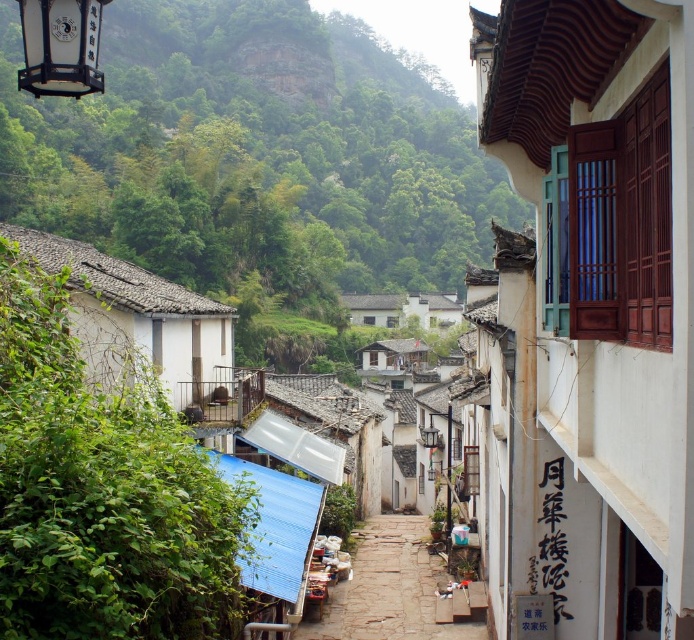
You are a tourist walking through the stone paved alley at center and notice the matte black lantern at upper left. Which object takes up more space in the image?

The stone paved alley at center takes up more space in the image compared to the matte black lantern at upper left because it has a larger size.

You are standing in the cobblestone alleyway of the traditional Chinese village. You notice a point marked at coordinates (586, 321). Which object in the scene does this point belong to?

The point (586, 321) is on the white wooden window at upper right.

You are standing at the entrance of the cobblestone alleyway and want to locate both the white wooden window at upper right and the white tile hut at center. According to the scene, which one is positioned to the right side of the other?

The white wooden window at upper right is to the right of the white tile hut at center, so the white wooden window at upper right is positioned to the right side of the white tile hut at center.